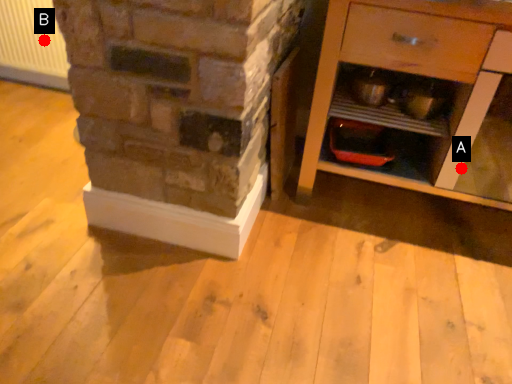
Question: Two points are circled on the image, labeled by A and B beside each circle. Among these points, which one is farthest from the camera?

Choices:
 (A) A is further
 (B) B is further

Answer: (B)